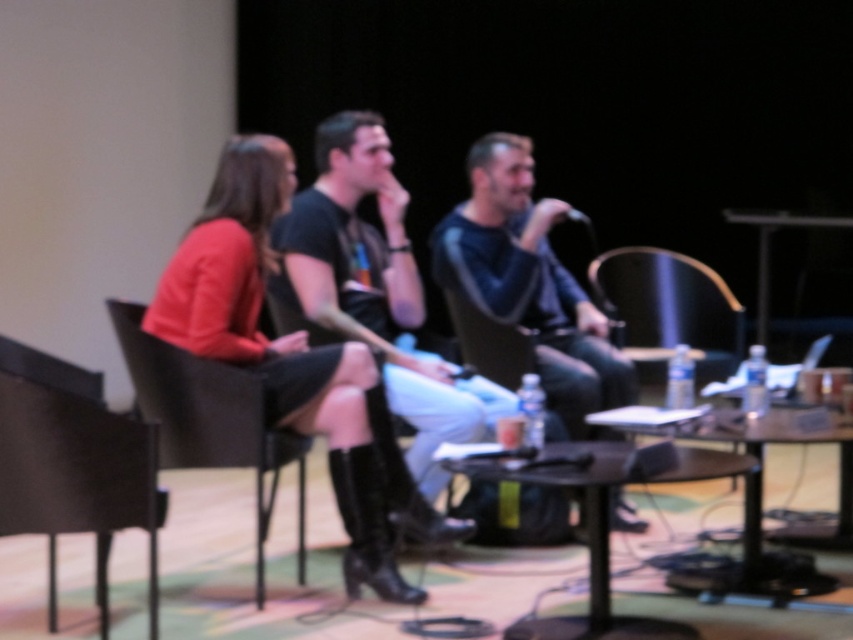
Question: Which object appears closest to the camera in this image?

Choices:
 (A) matte red sweater at center
 (B) wooden table at right

Answer: (A)

Question: Estimate the real-world distances between objects in this image. Which object is closer to the black leather chair at left?

Choices:
 (A) wooden table at right
 (B) dark blue sweater at center
 (C) black wicker chair at left

Answer: (C)

Question: Considering the relative positions of black leather chair at left and wooden round table at center in the image provided, where is black leather chair at left located with respect to wooden round table at center?

Choices:
 (A) above
 (B) below

Answer: (A)

Question: Does black matte shirt at center have a larger size compared to wooden round table at center?

Choices:
 (A) no
 (B) yes

Answer: (B)

Question: Observing the image, what is the correct spatial positioning of black leather chair at left in reference to black leather chair at center?

Choices:
 (A) below
 (B) above

Answer: (A)

Question: Which of the following is the closest to the observer?

Choices:
 (A) (173, 257)
 (B) (479, 209)

Answer: (A)